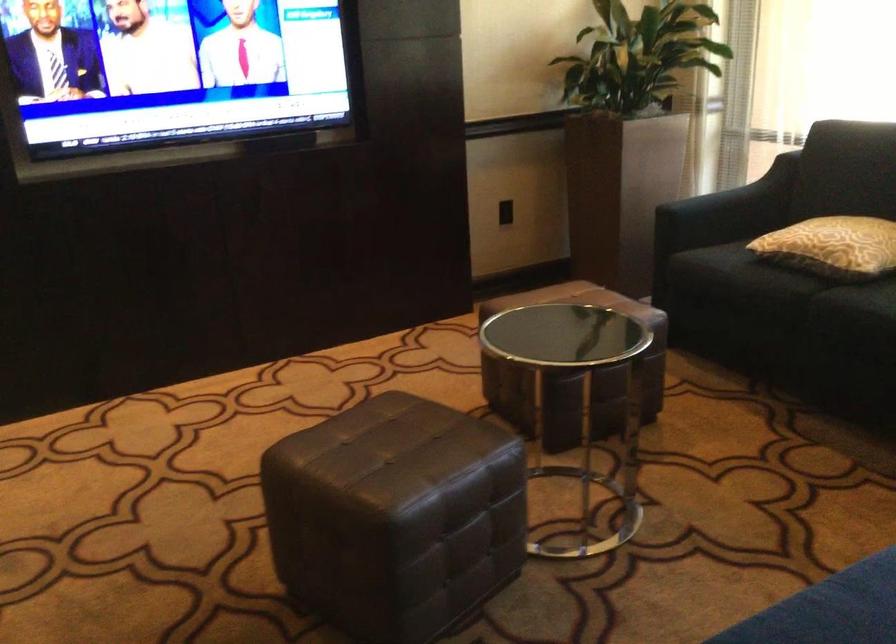
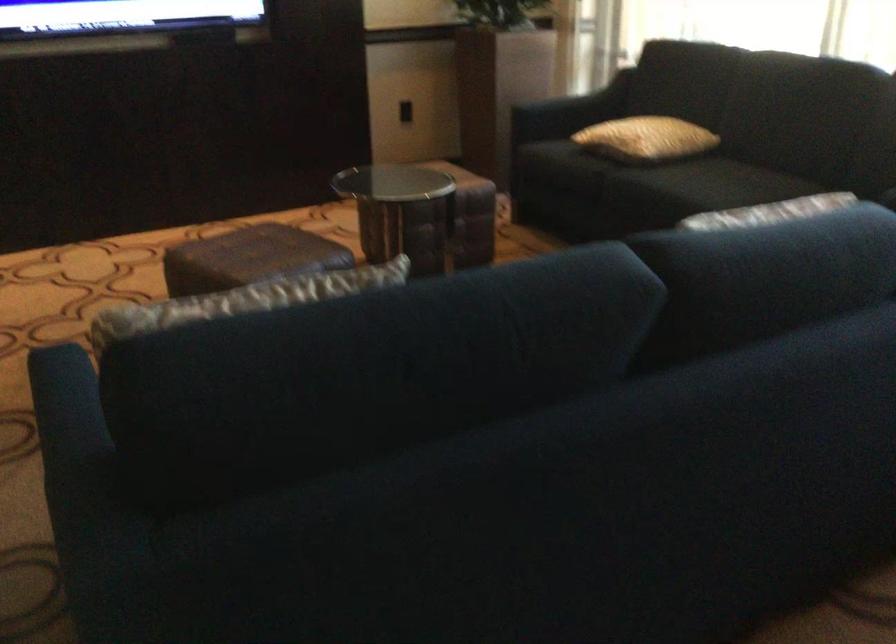
Question: The images are taken continuously from a first-person perspective. In which direction is your viewpoint rotating?

Choices:
 (A) Left
 (B) Right
 (C) Up
 (D) Down

Answer: (D)